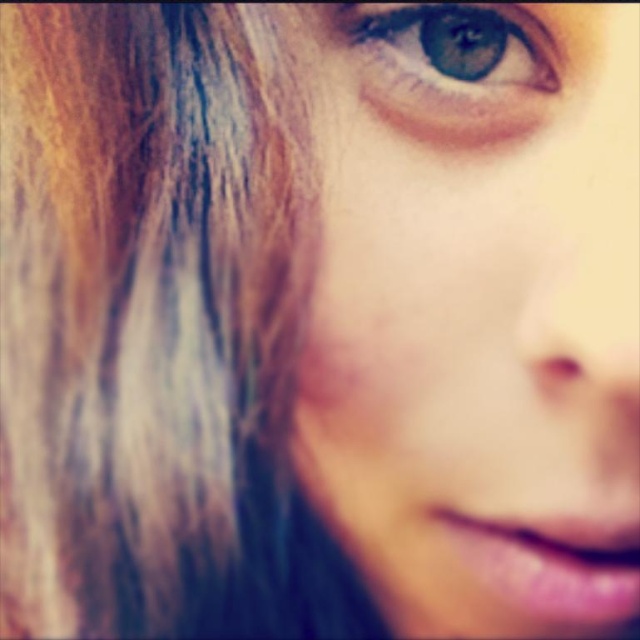
Question: Is smooth skin face at upper right positioned before shiny brown hair at left?

Choices:
 (A) yes
 (B) no

Answer: (A)

Question: Which object appears closest to the camera in this image?

Choices:
 (A) shiny brown hair at left
 (B) smooth skin face at upper right

Answer: (B)

Question: Which point is farther to the camera?

Choices:
 (A) blue glossy eye at upper center
 (B) shiny brown hair at left
 (C) smooth skin face at upper right

Answer: (B)

Question: Is shiny brown hair at left closer to camera compared to blue glossy eye at upper center?

Choices:
 (A) yes
 (B) no

Answer: (B)

Question: Which object is closer to the camera taking this photo?

Choices:
 (A) smooth skin face at upper right
 (B) blue glossy eye at upper center

Answer: (A)

Question: Is smooth skin face at upper right wider than blue glossy eye at upper center?

Choices:
 (A) no
 (B) yes

Answer: (B)